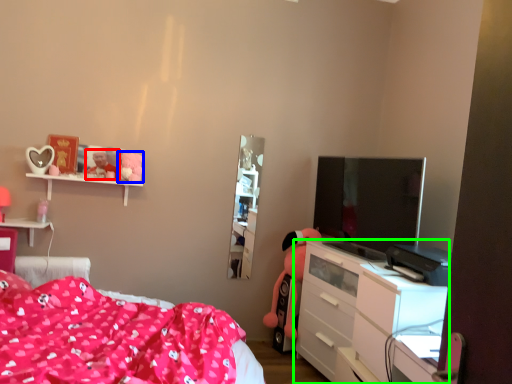
Question: Based on their relative distances, which object is farther from toy (highlighted by a red box)? Choose from toy (highlighted by a blue box) and chest of drawers (highlighted by a green box).

Choices:
 (A) toy
 (B) chest of drawers

Answer: (B)